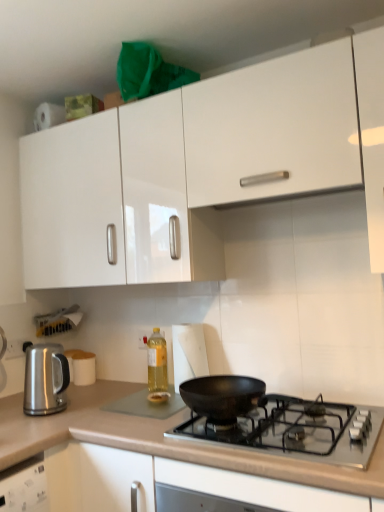
Question: From a real-world perspective, is white paper towel at center positioned above or below white glossy cabinet at upper center?

Choices:
 (A) below
 (B) above

Answer: (A)

Question: From the image's perspective, is white paper towel at center located above or below white glossy cabinet at upper center?

Choices:
 (A) above
 (B) below

Answer: (B)

Question: Which of these objects is positioned closest to the white matte cup at center-left?

Choices:
 (A) white glossy cabinet at upper center
 (B) translucent yellow liquid at center
 (C) white paper towel at center
 (D) black matte pan at center
 (E) smooth beige countertop at lower center

Answer: (B)

Question: Estimate the real-world distances between objects in this image. Which object is closer to the black matte pan at center?

Choices:
 (A) white paper towel at center
 (B) white glossy cabinet at upper center
 (C) satin metallic kettle at left
 (D) smooth beige countertop at lower center
 (E) white matte cup at center-left

Answer: (D)